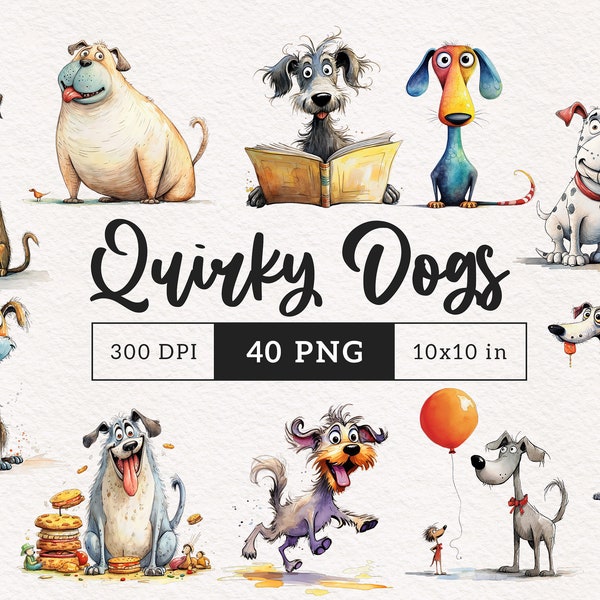
I want to click on book, so click(x=338, y=176).